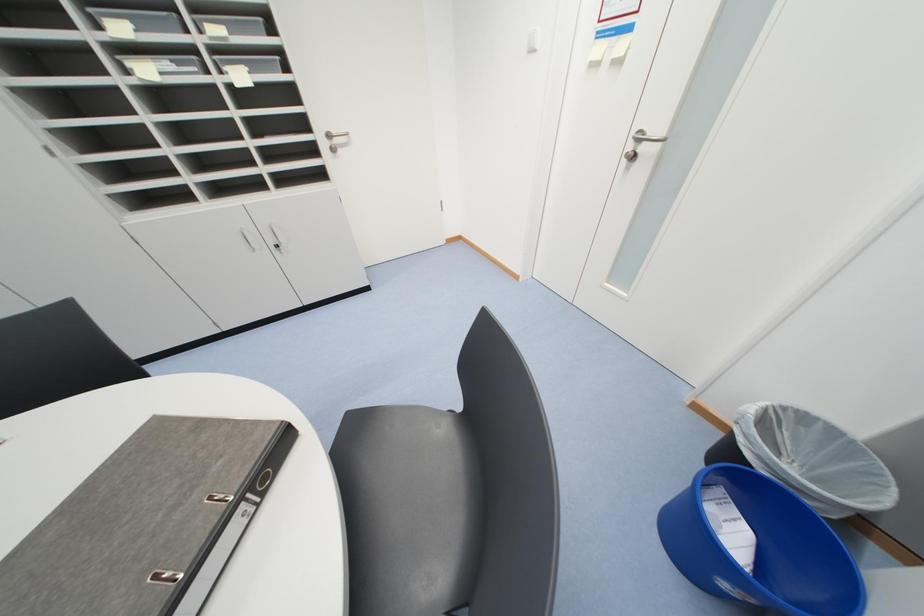
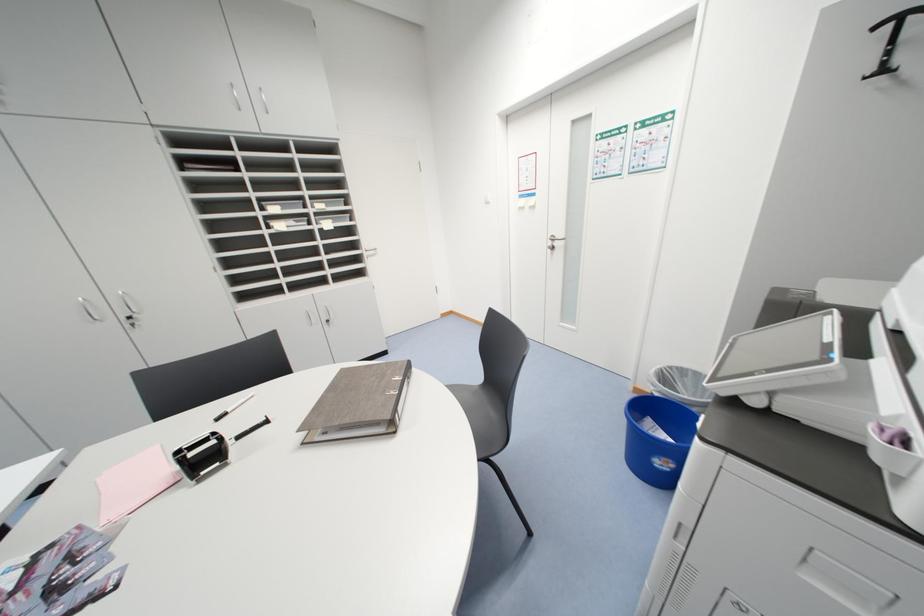
Question: The first image is from the beginning of the video and the second image is from the end. How did the camera likely rotate when shooting the video?

Choices:
 (A) Left
 (B) Right
 (C) Up
 (D) Down

Answer: (C)